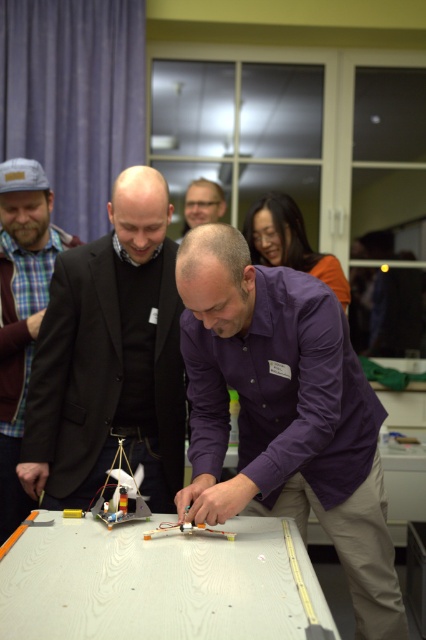
Who is shorter, white wood table at center or plaid fabric shirt at left?

With less height is white wood table at center.

Who is positioned more to the right, white wood table at center or plaid fabric shirt at left?

white wood table at center is more to the right.

In the scene shown: Who is more distant from viewer, (x=100, y=573) or (x=0, y=264)?

Point (x=0, y=264)

The image size is (426, 640). What are the coordinates of `white wood table at center` in the screenshot? It's located at (157, 582).

Does point (91, 323) lie behind point (210, 221)?

No.

Consider the image. Can you confirm if black matte suit at center is wider than matte black glasses at upper center?

Yes, black matte suit at center is wider than matte black glasses at upper center.

Which is behind, point (57, 260) or point (206, 200)?

Point (206, 200)

Where is `black matte suit at center`? This screenshot has height=640, width=426. black matte suit at center is located at coordinates (108, 348).

Can you confirm if white wood table at center is positioned to the right of matte black glasses at upper center?

Correct, you'll find white wood table at center to the right of matte black glasses at upper center.

Is white wood table at center positioned in front of matte black glasses at upper center?

Yes.

Measure the distance between point (86, 604) and camera.

They are 1.18 meters apart.

Image resolution: width=426 pixels, height=640 pixels. What are the coordinates of `white wood table at center` in the screenshot? It's located at (157, 582).